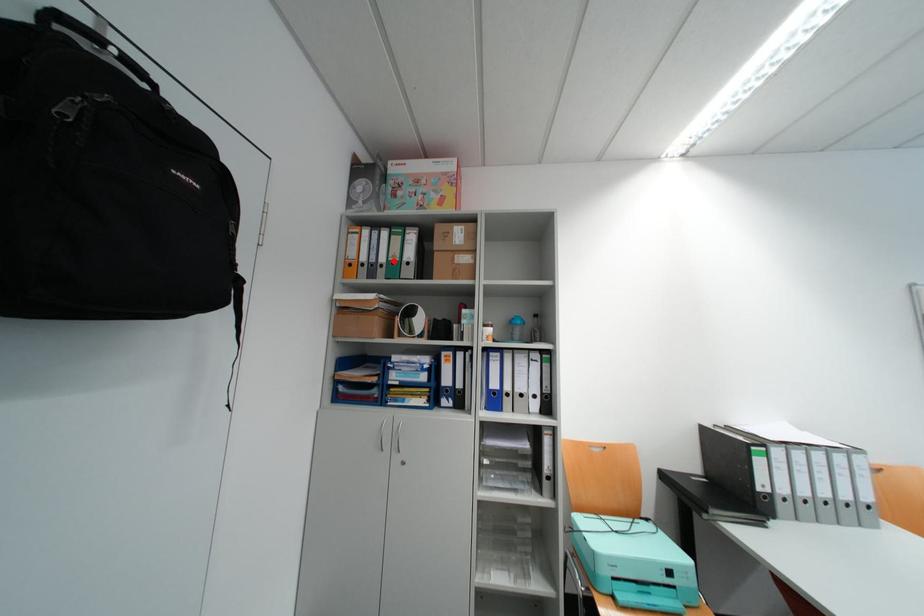
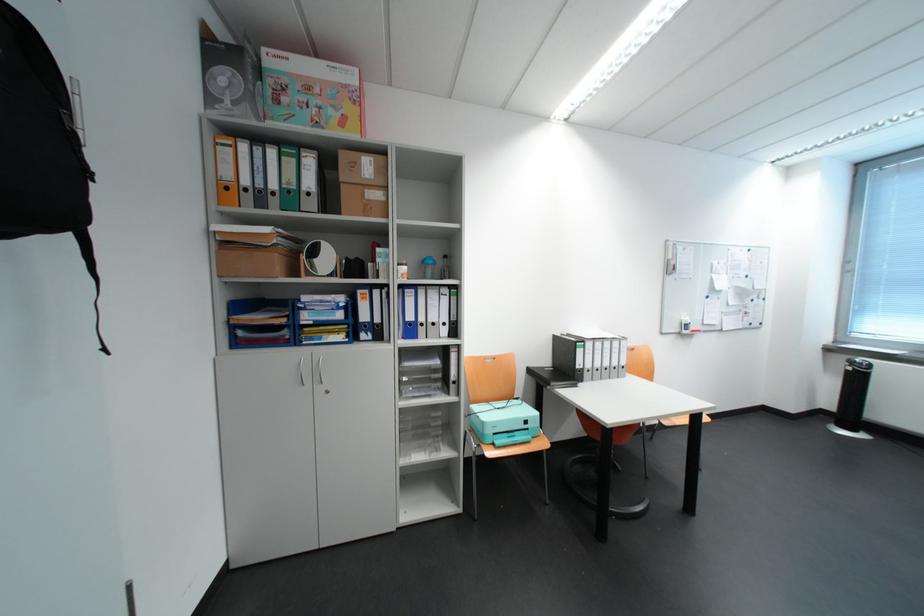
Locate, in the second image, the point that corresponds to the highlighted location in the first image.

(285, 188)